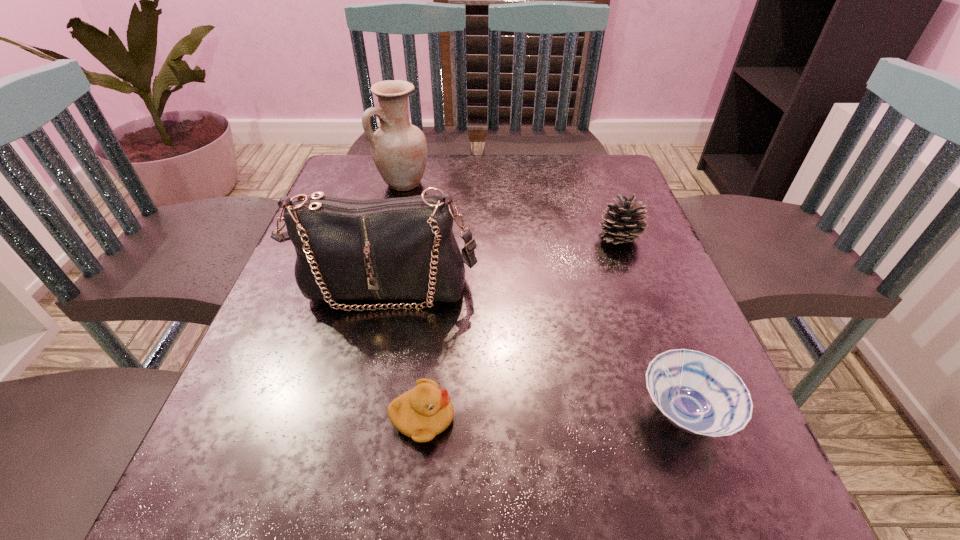
The height and width of the screenshot is (540, 960). In the image, there is a desktop. Identify the location of free space at the right edge. (703, 457).

You are a GUI agent. You are given a task and a screenshot of the screen. Output one action in this format:
    pyautogui.click(x=<x>, y=<y>)
    Task: Click on the blank space at the far left corner of the desktop
    The image size is (960, 540).
    Given the screenshot: What is the action you would take?
    [335, 190]

Image resolution: width=960 pixels, height=540 pixels. In order to click on free space at the far right corner of the desktop in this screenshot , I will do `click(574, 178)`.

In the image, there is a desktop. At what (x,y) coordinates should I click in order to perform the action: click on vacant space at the near right corner. Please return your answer as a coordinate pair (x, y). Looking at the image, I should click on (753, 524).

What are the coordinates of `free space between the fourth nearest object and the third nearest object` in the screenshot? It's located at (503, 263).

The height and width of the screenshot is (540, 960). In order to click on vacant point located between the farthest object and the shortest object in this screenshot , I will do `click(543, 298)`.

Find the location of `vacant point located between the fourth nearest object and the handbag`. vacant point located between the fourth nearest object and the handbag is located at coordinates (503, 263).

Image resolution: width=960 pixels, height=540 pixels. Find the location of `vacant area that lies between the third farthest object and the third shortest object`. vacant area that lies between the third farthest object and the third shortest object is located at coordinates (503, 263).

Where is `unoccupied area between the pottery and the second shortest object`? unoccupied area between the pottery and the second shortest object is located at coordinates (413, 301).

The height and width of the screenshot is (540, 960). I want to click on vacant point located between the third tallest object and the shortest object, so click(652, 326).